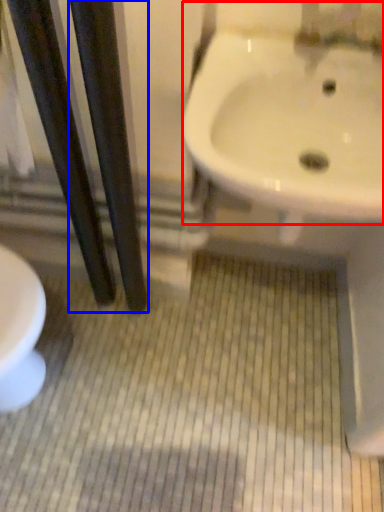
Question: Which object is closer to the camera taking this photo, sink (highlighted by a red box) or pole (highlighted by a blue box)?

Choices:
 (A) sink
 (B) pole

Answer: (B)